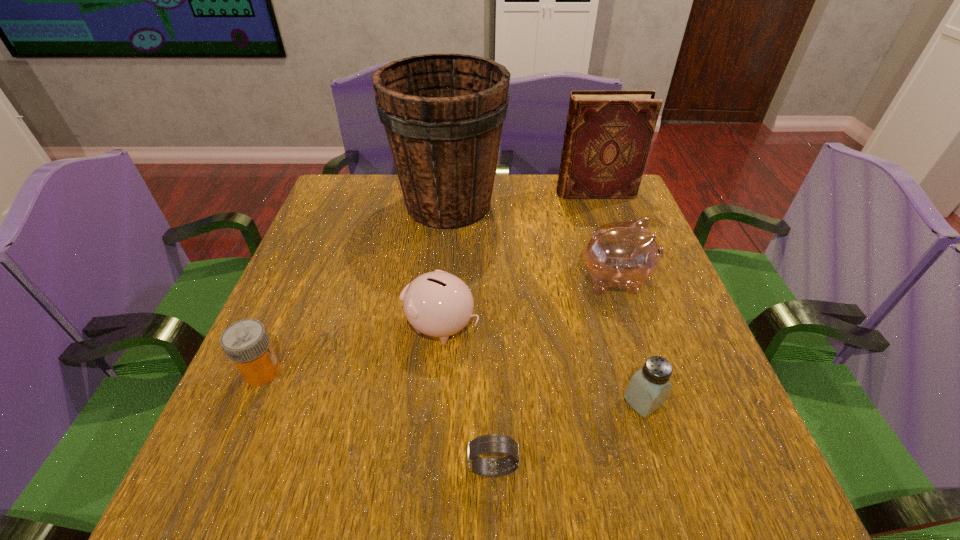
In the image, there is a desktop. What are the coordinates of `vacant space at the right edge` in the screenshot? It's located at [705, 376].

The height and width of the screenshot is (540, 960). Identify the location of vacant space at the near left corner of the desktop. (203, 485).

The height and width of the screenshot is (540, 960). I want to click on vacant space at the near right corner, so click(x=711, y=485).

This screenshot has width=960, height=540. In order to click on free spot between the hardback book and the saltshaker in this screenshot , I will do `click(619, 297)`.

Identify the location of free area in between the nearer piggy bank and the medicine. tap(351, 349).

The height and width of the screenshot is (540, 960). Find the location of `free spot between the leftmost object and the bucket`. free spot between the leftmost object and the bucket is located at coordinates (356, 288).

In order to click on free space between the fourth tallest object and the medicine in this screenshot , I will do `click(351, 349)`.

Where is `vacant area that lies between the second tallest object and the tallest object`? vacant area that lies between the second tallest object and the tallest object is located at coordinates pos(522,199).

You are a GUI agent. You are given a task and a screenshot of the screen. Output one action in this format:
    pyautogui.click(x=<x>, y=<y>)
    Task: Click on the empty space that is in between the shorter piggy bank and the bucket
    
    Given the screenshot: What is the action you would take?
    pyautogui.click(x=444, y=265)

Identify the location of vacant area that lies between the fourth nearest object and the second tallest object. (517, 259).